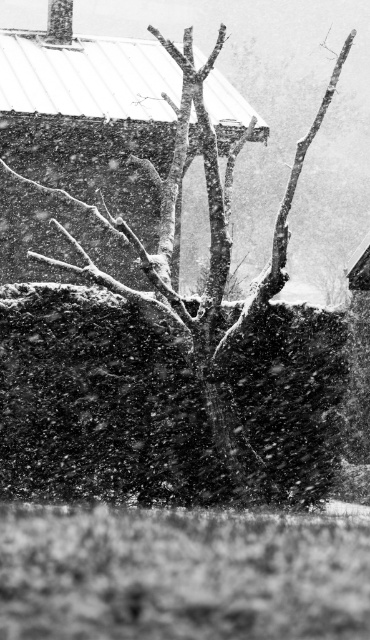
Question: Which object is farther from the camera taking this photo?

Choices:
 (A) smooth white snow at center
 (B) smooth bark tree at center

Answer: (A)

Question: Among these objects, which one is nearest to the camera?

Choices:
 (A) smooth white snow at center
 (B) smooth bark tree at center

Answer: (B)

Question: Is smooth bark tree at center bigger than smooth white snow at center?

Choices:
 (A) no
 (B) yes

Answer: (A)

Question: Can you confirm if smooth bark tree at center is positioned above smooth white snow at center?

Choices:
 (A) yes
 (B) no

Answer: (B)

Question: Which point is farther to the camera?

Choices:
 (A) (27, 192)
 (B) (160, 248)

Answer: (A)

Question: Does smooth bark tree at center appear on the right side of smooth white snow at center?

Choices:
 (A) yes
 (B) no

Answer: (A)